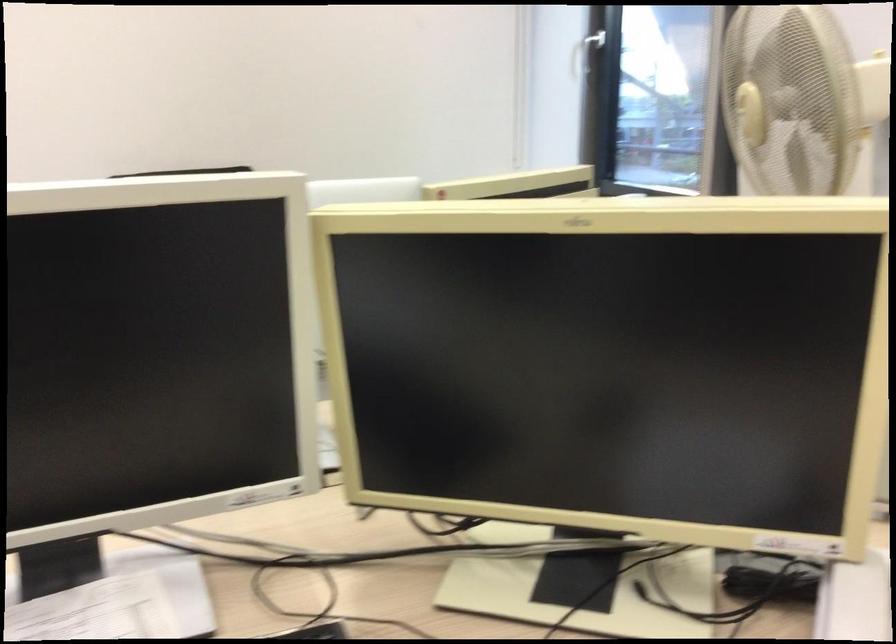
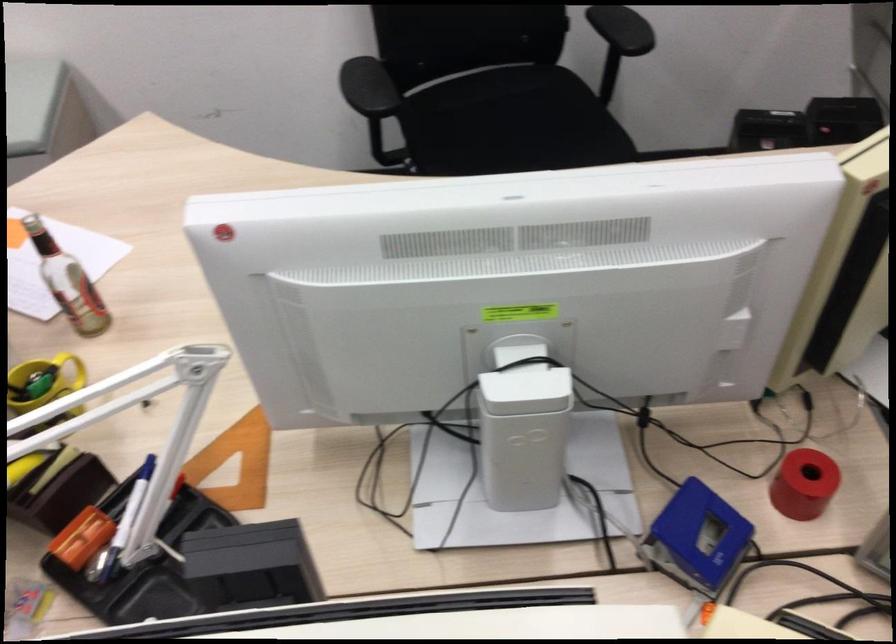
Question: The first image is from the beginning of the video and the second image is from the end. How did the camera likely rotate when shooting the video?

Choices:
 (A) Left
 (B) Right
 (C) Up
 (D) Down

Answer: (D)